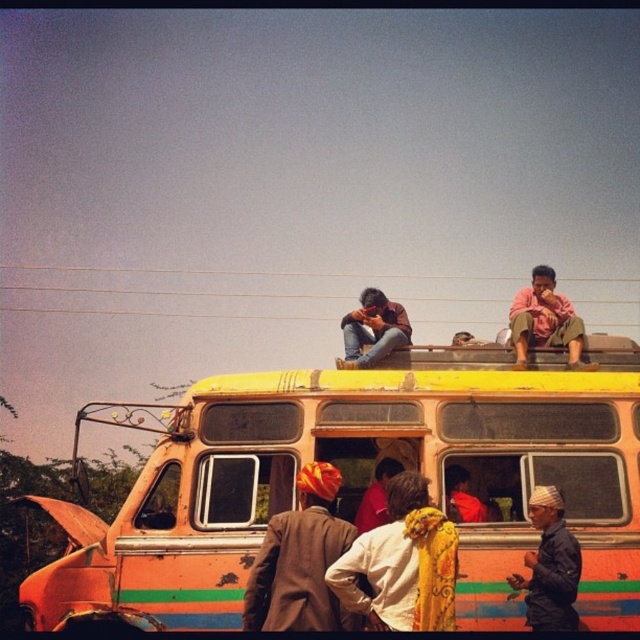
Who is more distant from viewer, (353, 556) or (384, 344)?

The point (384, 344) is behind.

How much distance is there between yellow fabric headscarf at center and jeans at center?

yellow fabric headscarf at center is 6.06 meters away from jeans at center.

I want to click on yellow fabric headscarf at center, so click(403, 563).

At what (x,y) coordinates should I click in order to perform the action: click on yellow fabric headscarf at center. Please return your answer as a coordinate pair (x, y). This screenshot has width=640, height=640. Looking at the image, I should click on (403, 563).

Locate an element on the screen. brown textured coat at center is located at coordinates (300, 561).

Which is below, brown textured coat at center or pink fabric pants at upper right?

brown textured coat at center

Who is more forward, (260,611) or (518,364)?

Point (260,611)

Identify the location of brown textured coat at center. This screenshot has width=640, height=640. click(x=300, y=561).

Locate an element on the screen. orange painted bus at center is located at coordinates (362, 480).

Can you confirm if orange painted bus at center is smaller than dark blue fabric at lower right?

Actually, orange painted bus at center might be larger than dark blue fabric at lower right.

The height and width of the screenshot is (640, 640). What do you see at coordinates (362, 480) in the screenshot? I see `orange painted bus at center` at bounding box center [362, 480].

Identify the location of orange painted bus at center. (362, 480).